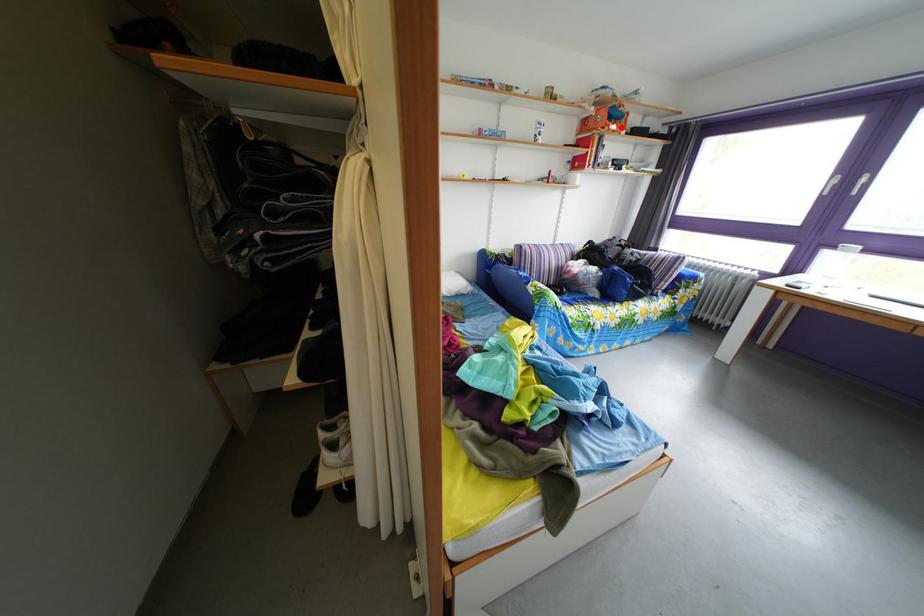
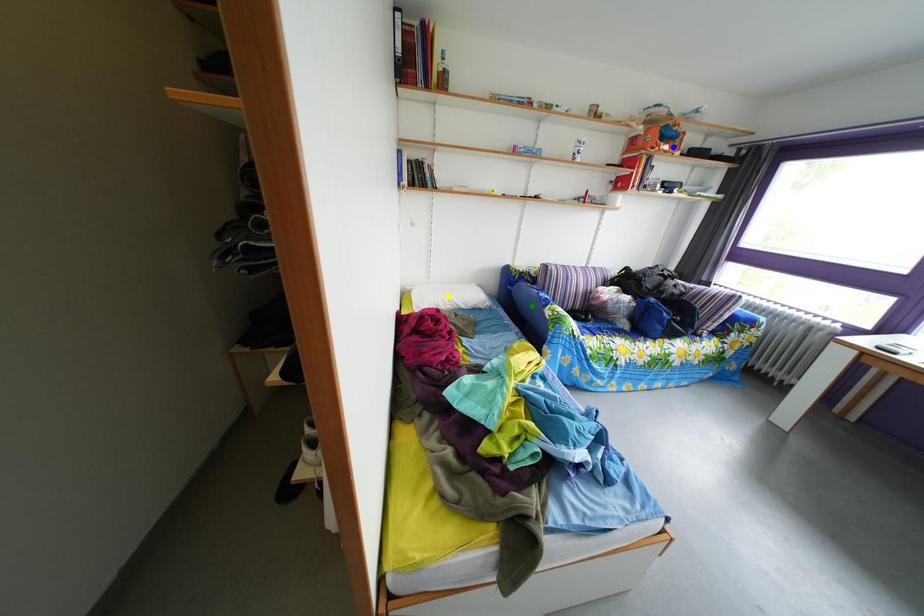
Question: I am providing you with two images of the same scene from different viewpoints. A red point is marked on the first image. You are given multiple points on the second image. Which point in image 2 is actually the same real-world point as the red point in image 1?

Choices:
 (A) yellow point
 (B) blue point
 (C) green point

Answer: (B)